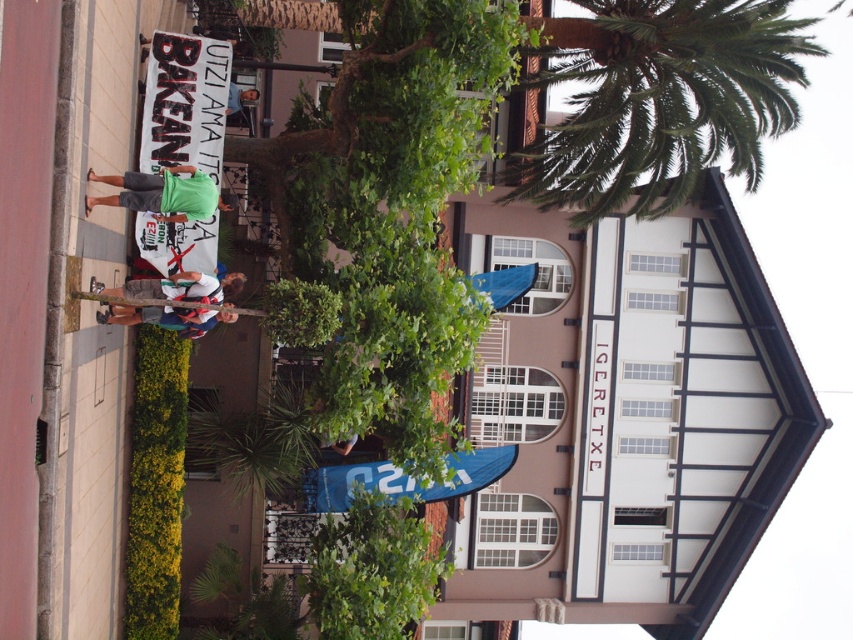
Is light brown leather jacket at center to the right of green fabric sign at upper center from the viewer's perspective?

Incorrect, light brown leather jacket at center is not on the right side of green fabric sign at upper center.

Who is more distant from viewer, (231, 314) or (241, 92)?

The point (241, 92) is behind.

I want to click on light brown leather jacket at center, so click(119, 317).

The width and height of the screenshot is (853, 640). Identify the location of light brown leather jacket at center. (119, 317).

Who is more distant from viewer, (x=741, y=72) or (x=183, y=221)?

Positioned behind is point (x=741, y=72).

Does green leafy palm tree at upper right appear under green fabric shirt at center?

No.

Does point (717, 45) lie in front of point (189, 211)?

No, it is not.

Locate an element on the screen. This screenshot has height=640, width=853. green leafy palm tree at upper right is located at coordinates (665, 102).

Does green fabric shirt at center have a smaller size compared to white cotton shirt at center?

No.

Looking at this image, does green fabric shirt at center come behind white cotton shirt at center?

No, green fabric shirt at center is in front of white cotton shirt at center.

I want to click on green fabric shirt at center, so click(x=164, y=193).